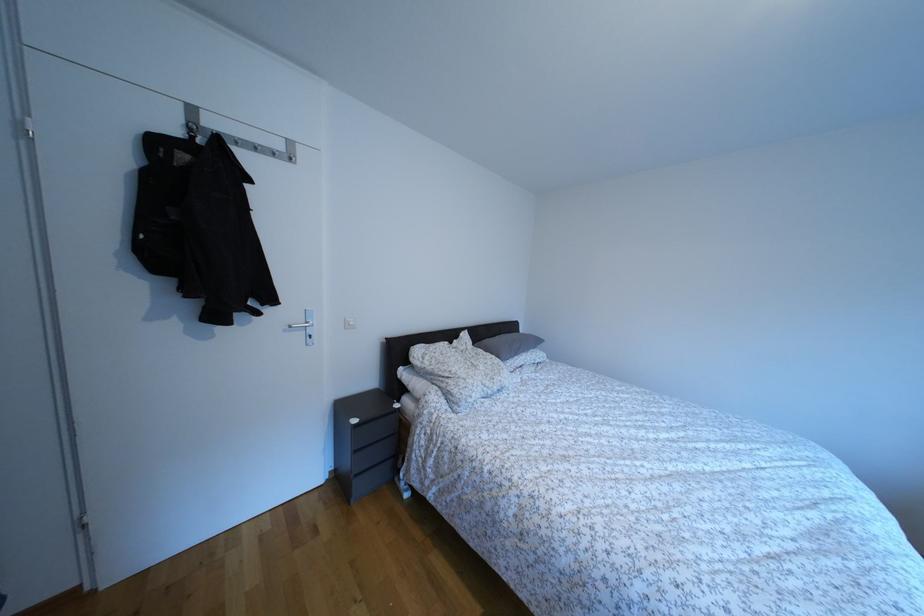
Locate an element on the screen. The image size is (924, 616). cabinet drawer is located at coordinates (370, 411).